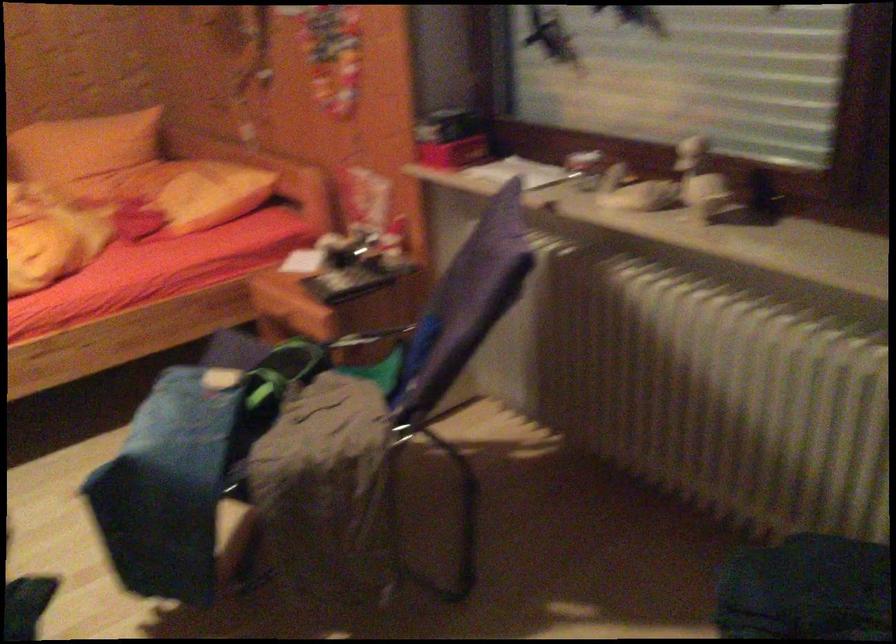
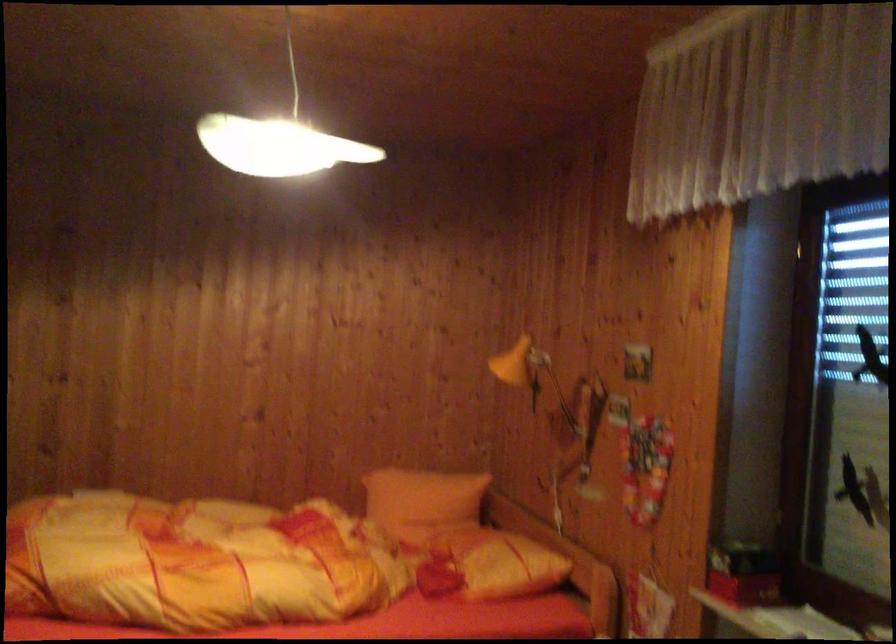
First-person continuous shooting, in which direction is the camera rotating?

The rotation direction of the camera is left-up.